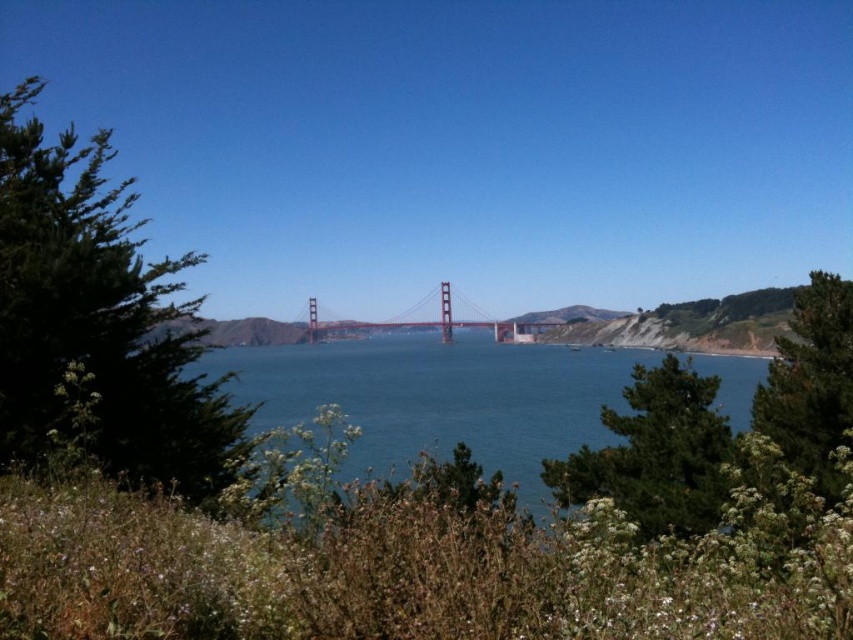
Is green leafy tree at left smaller than blue water at center?

Yes, green leafy tree at left is smaller than blue water at center.

Identify the location of green leafy tree at left. coord(97,317).

Where is `green leafy tree at left`? Image resolution: width=853 pixels, height=640 pixels. green leafy tree at left is located at coordinates (97, 317).

I want to click on blue water at center, so click(x=437, y=397).

Measure the distance between blue water at center and painted steel bridge at center.

blue water at center and painted steel bridge at center are 512.88 feet apart from each other.

Locate an element on the screen. This screenshot has height=640, width=853. blue water at center is located at coordinates (437, 397).

Who is lower down, green leafy tree at left or green leafy tree at right?

green leafy tree at right is lower down.

Is point (198, 445) positioned after point (810, 273)?

That is False.

Where is `green leafy tree at left`? The width and height of the screenshot is (853, 640). green leafy tree at left is located at coordinates (97, 317).